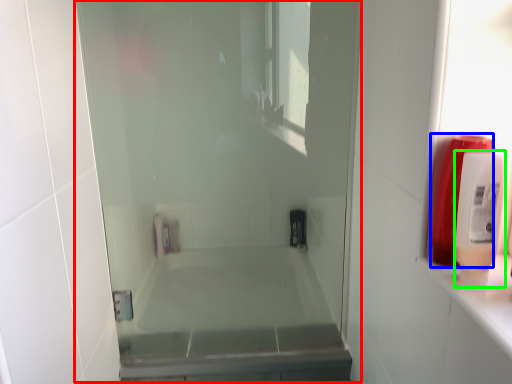
Question: Which is farther away from screen door (highlighted by a red box)? soap dispenser (highlighted by a blue box) or soap dispenser (highlighted by a green box)?

Choices:
 (A) soap dispenser
 (B) soap dispenser

Answer: (B)